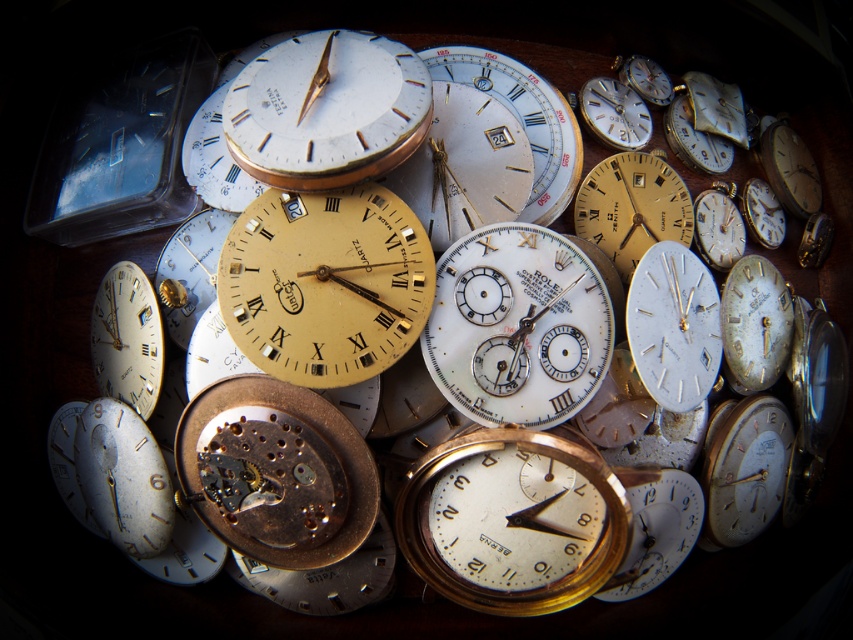
Does gold metallic watch face at center have a lesser width compared to gold-plated pocket watch at center?

Yes, gold metallic watch face at center is thinner than gold-plated pocket watch at center.

Locate an element on the screen. The height and width of the screenshot is (640, 853). gold metallic watch face at center is located at coordinates (325, 284).

Can you confirm if white metallic watch face at center is positioned below matte gold watch face at lower left?

No.

Looking at this image, between white metallic watch face at center and matte gold watch face at lower left, which one is positioned higher?

white metallic watch face at center is higher up.

Between point (627, 198) and point (109, 285), which one is positioned behind?

The point (627, 198) is behind.

The image size is (853, 640). I want to click on white metallic watch face at center, so click(x=631, y=208).

Does gold metallic watch face at center appear on the left side of white metallic watch face at center?

Indeed, gold metallic watch face at center is positioned on the left side of white metallic watch face at center.

Does point (405, 288) come behind point (607, 232)?

No.

Find the location of a particular element. The width and height of the screenshot is (853, 640). gold metallic watch face at center is located at coordinates (325, 284).